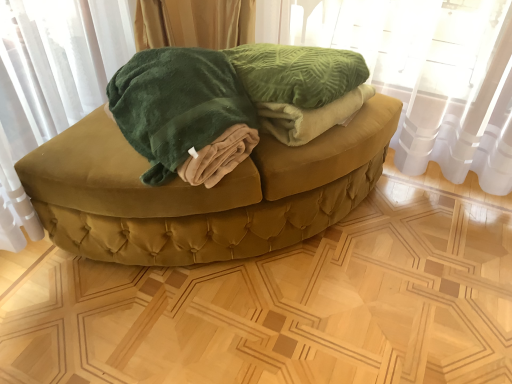
Question: Does velvety green blanket at center have a greater width compared to velvet green ottoman at center?

Choices:
 (A) no
 (B) yes

Answer: (A)

Question: Is the depth of velvety green blanket at center less than that of velvet green ottoman at center?

Choices:
 (A) yes
 (B) no

Answer: (A)

Question: Would you say velvety green blanket at center is a long distance from velvet green ottoman at center?

Choices:
 (A) yes
 (B) no

Answer: (B)

Question: Considering the relative sizes of velvety green blanket at center and velvet green ottoman at center in the image provided, is velvety green blanket at center bigger than velvet green ottoman at center?

Choices:
 (A) no
 (B) yes

Answer: (A)

Question: Does velvety green blanket at center contain velvet green ottoman at center?

Choices:
 (A) yes
 (B) no

Answer: (B)

Question: Is point (197, 127) positioned closer to the camera than point (200, 221)?

Choices:
 (A) farther
 (B) closer

Answer: (B)

Question: Considering their positions, is velvety green blanket at center located in front of or behind velvet green ottoman at center?

Choices:
 (A) behind
 (B) front

Answer: (B)

Question: Is velvety green blanket at center inside the boundaries of velvet green ottoman at center, or outside?

Choices:
 (A) inside
 (B) outside

Answer: (B)

Question: From the image's perspective, is velvety green blanket at center located above or below velvet green ottoman at center?

Choices:
 (A) above
 (B) below

Answer: (A)

Question: Visually, is green velvet curtain at upper center positioned to the left or to the right of velvet green ottoman at center?

Choices:
 (A) left
 (B) right

Answer: (B)

Question: In terms of width, does green velvet curtain at upper center look wider or thinner when compared to velvet green ottoman at center?

Choices:
 (A) thin
 (B) wide

Answer: (A)

Question: From the image's perspective, relative to velvet green ottoman at center, is green velvet curtain at upper center above or below?

Choices:
 (A) below
 (B) above

Answer: (B)

Question: Is green velvet curtain at upper center in front of or behind velvet green ottoman at center in the image?

Choices:
 (A) front
 (B) behind

Answer: (A)

Question: Is velvet green ottoman at center taller or shorter than green velvet curtain at upper center?

Choices:
 (A) short
 (B) tall

Answer: (B)

Question: Which is correct: velvet green ottoman at center is inside green velvet curtain at upper center, or outside of it?

Choices:
 (A) inside
 (B) outside

Answer: (B)